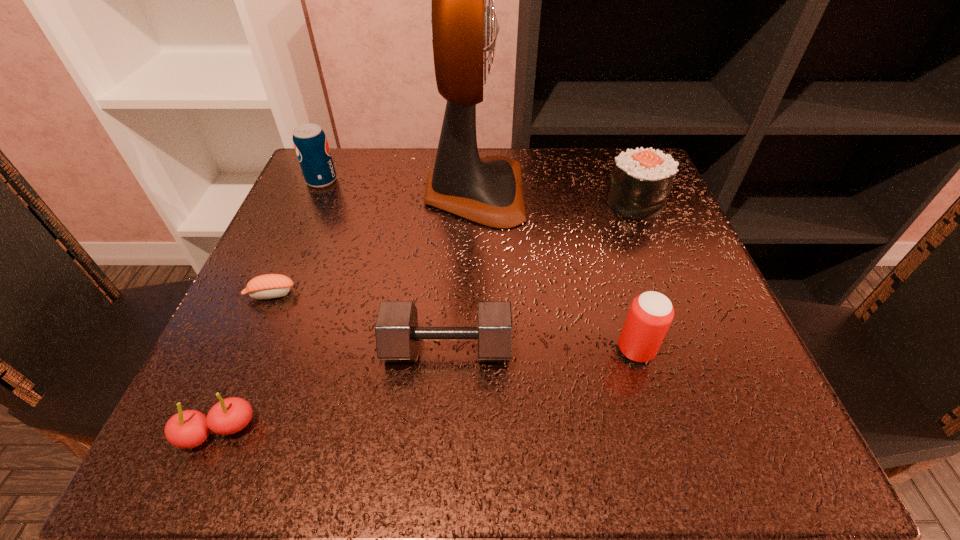
Locate an element on the screen. The image size is (960, 540). fan is located at coordinates (488, 191).

The image size is (960, 540). I want to click on pop, so click(x=310, y=142).

You are a GUI agent. You are given a task and a screenshot of the screen. Output one action in this format:
    pyautogui.click(x=<x>, y=<y>)
    Task: Click on the taller sushi
    The width and height of the screenshot is (960, 540).
    Given the screenshot: What is the action you would take?
    pyautogui.click(x=641, y=179)

You are a GUI agent. You are given a task and a screenshot of the screen. Output one action in this format:
    pyautogui.click(x=<x>, y=<y>)
    Task: Click on the farther sushi
    
    Given the screenshot: What is the action you would take?
    pyautogui.click(x=641, y=179)

At what (x,y) coordinates should I click in order to perform the action: click on beer can. Please return your answer as a coordinate pair (x, y). Looking at the image, I should click on tap(651, 313).

Identify the location of dumbbell. The width and height of the screenshot is (960, 540). (397, 333).

Identify the location of the nearest object. (187, 429).

Image resolution: width=960 pixels, height=540 pixels. Identify the location of the nearer sushi. (268, 286).

Locate an element on the screen. the fourth farthest object is located at coordinates (268, 286).

Find the location of a particular element. This screenshot has width=960, height=540. free spot located on the front-facing side of the tallest object is located at coordinates (589, 192).